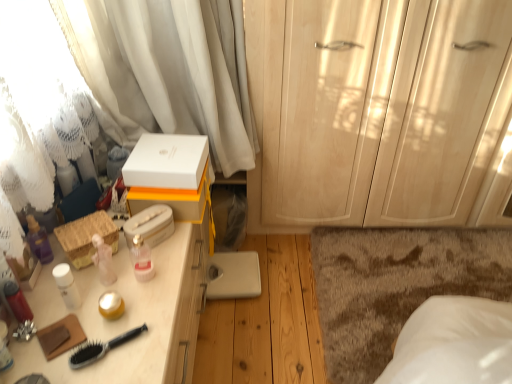
Identify the location of vacant space that is in between white matte tissue box at upper center, positioned as the 2th storage box in top-to-bottom order, and pink glossy bottle at center, positioned as the 2th toiletry in left-to-right order. (147, 256).